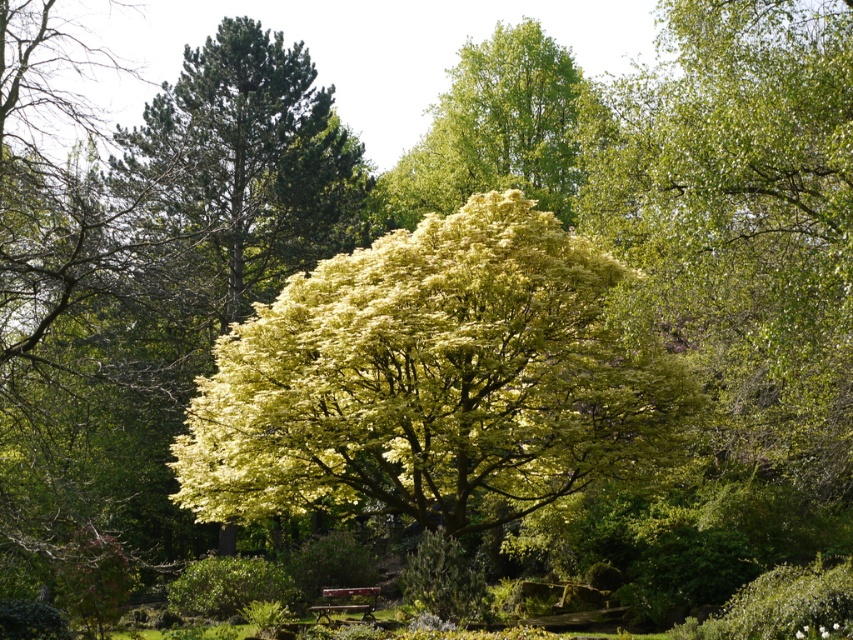
Question: Which object is the closest to the wooden bench at center?

Choices:
 (A) green leafy tree at upper center
 (B) yellow-green leafy tree at center

Answer: (B)

Question: Which of the following is the farthest from the observer?

Choices:
 (A) (672, 384)
 (B) (334, 609)

Answer: (B)

Question: Can you confirm if yellow-green leafy tree at center is smaller than green leafy tree at upper center?

Choices:
 (A) yes
 (B) no

Answer: (A)

Question: Does yellow-green leafy tree at center come in front of wooden bench at center?

Choices:
 (A) yes
 (B) no

Answer: (A)

Question: Which of the following is the closest to the observer?

Choices:
 (A) (239, 474)
 (B) (325, 616)

Answer: (A)

Question: Does green leafy tree at upper center appear on the right side of wooden bench at center?

Choices:
 (A) yes
 (B) no

Answer: (A)